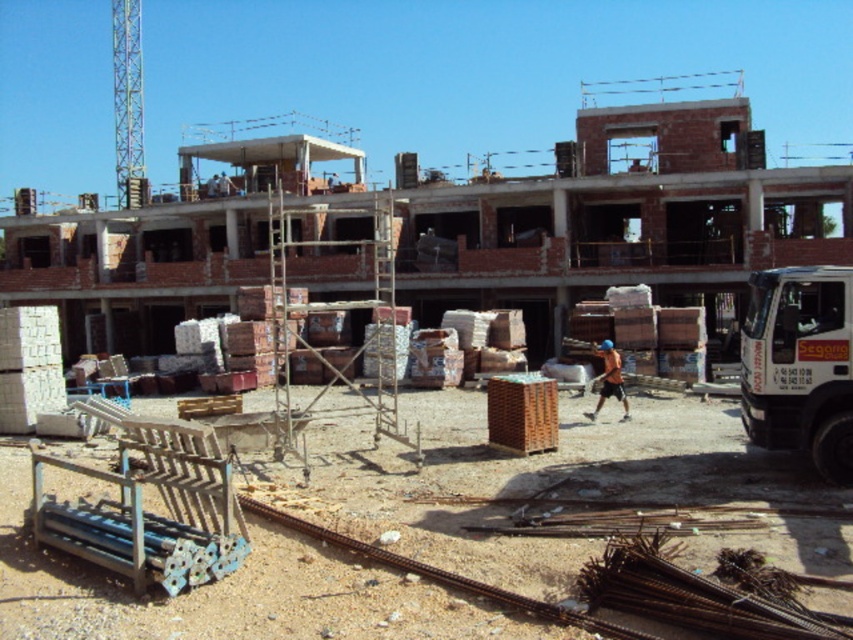
You are a construction supervisor who needs to move a heavy crate from the black metal train track at lower center to the orange fabric construction worker at center. Which direction should you move the crate to reach the worker?

You should move the crate to the right, since the black metal train track at lower center is to the left of the orange fabric construction worker at center.

You are a construction worker standing at the bottom left corner of the construction site. You need to transport materials from the blue bench to the black metal train track at lower center. Which direction should you move to reach the track first?

The black metal train track at lower center is located at point (440, 573), so you should move towards the center from the blue bench to reach the track first.

You are a delivery robot with a package that needs to be delivered to the orange fabric construction worker at center. You are currently positioned at the black metal train track at lower center. Given that your maximum carrying capacity is 10 kilograms and the package weighs 8 kilograms, can you safely navigate the 9.30 meters to deliver it without dropping it?

The distance between the black metal train track at lower center and the orange fabric construction worker at center is 9.30 meters. Since the package weighs 8 kilograms, which is under your 10 kilogram capacity, you can safely deliver it without dropping it.